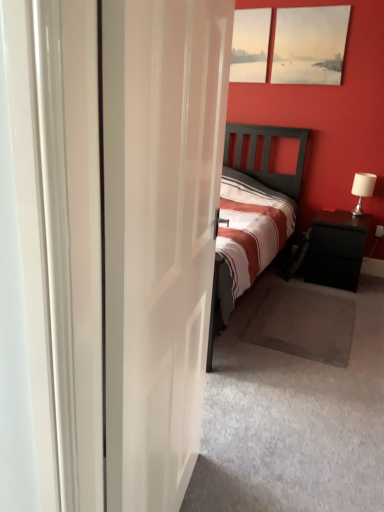
Question: In terms of width, does matte canvas painting at upper right, the 1th picture frame positioned from the right, look wider or thinner when compared to matte wooden picture frame at upper center, which ranks as the second picture frame in right-to-left order?

Choices:
 (A) thin
 (B) wide

Answer: (A)

Question: Is matte canvas painting at upper right, which appears as the second picture frame when viewed from the left, taller or shorter than matte wooden picture frame at upper center, which ranks as the second picture frame in right-to-left order?

Choices:
 (A) tall
 (B) short

Answer: (A)

Question: Which object is the closest to the matte canvas painting at upper right, the 1th picture frame positioned from the right?

Choices:
 (A) white fabric lampshade at right
 (B) black matte nightstand at right
 (C) white glossy door at center
 (D) matte wooden picture frame at upper center, the 1th picture frame from the left

Answer: (D)

Question: Estimate the real-world distances between objects in this image. Which object is farther from the matte canvas painting at upper right, which appears as the second picture frame when viewed from the left?

Choices:
 (A) black matte nightstand at right
 (B) matte wooden picture frame at upper center, which ranks as the second picture frame in right-to-left order
 (C) white glossy door at center
 (D) white fabric lampshade at right

Answer: (C)